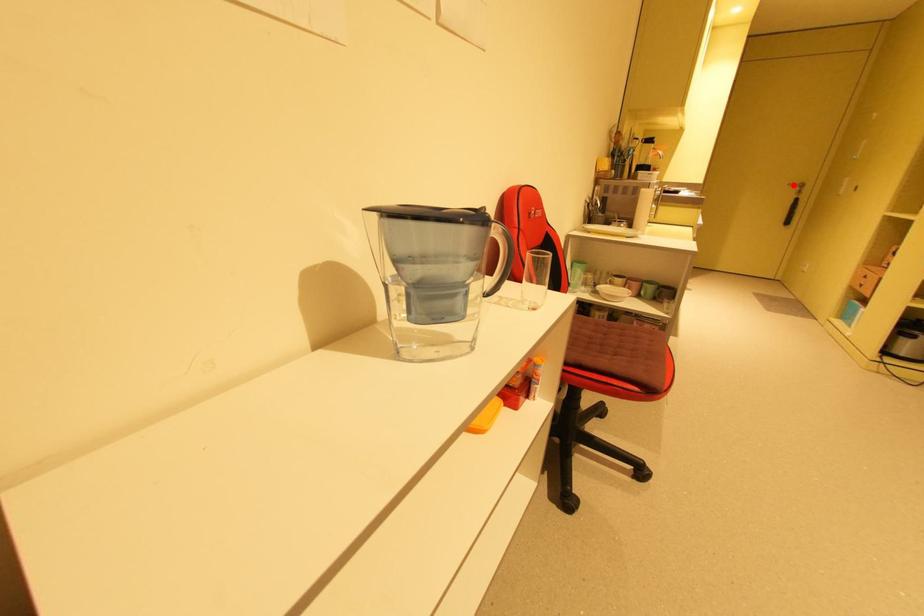
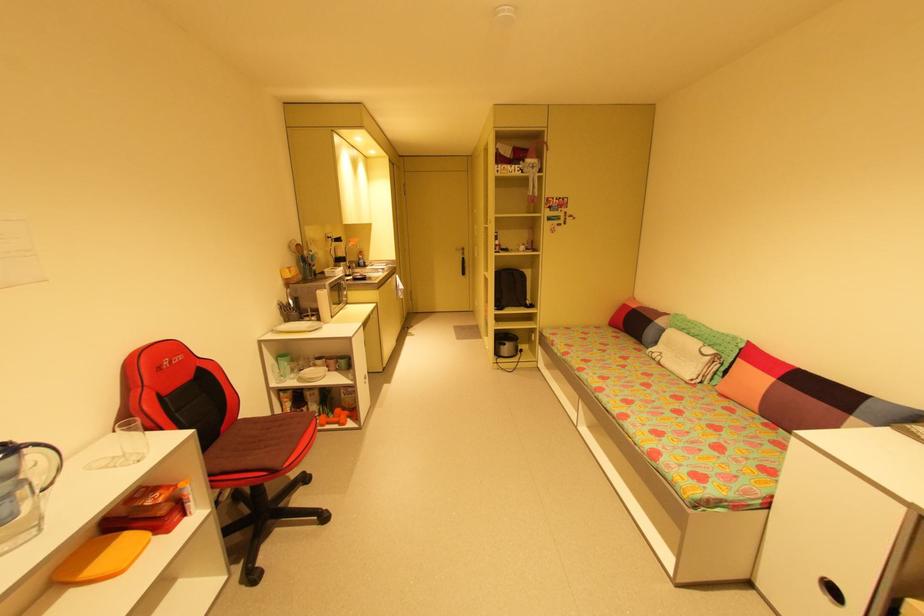
Where in the second image is the point corresponding to the highlighted location from the first image?

(460, 249)